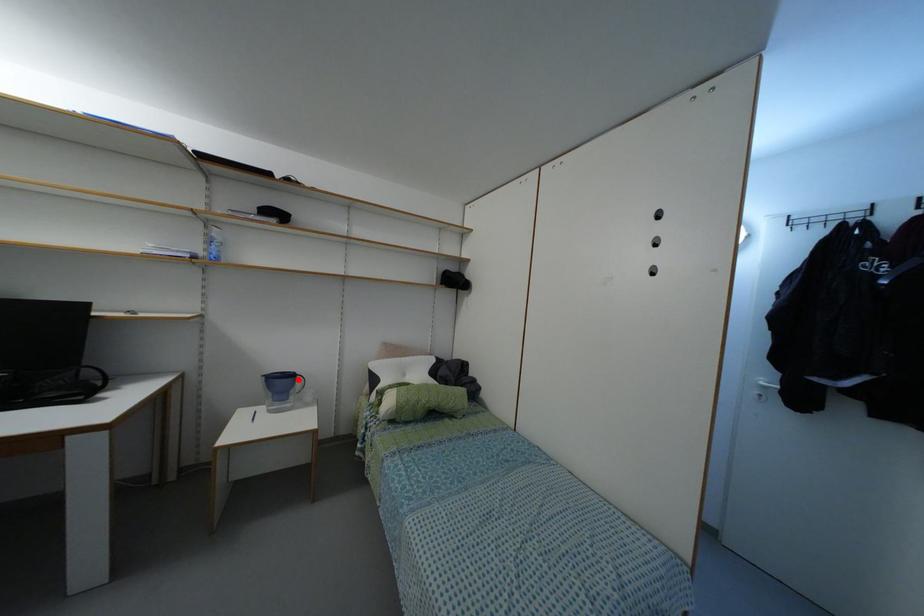
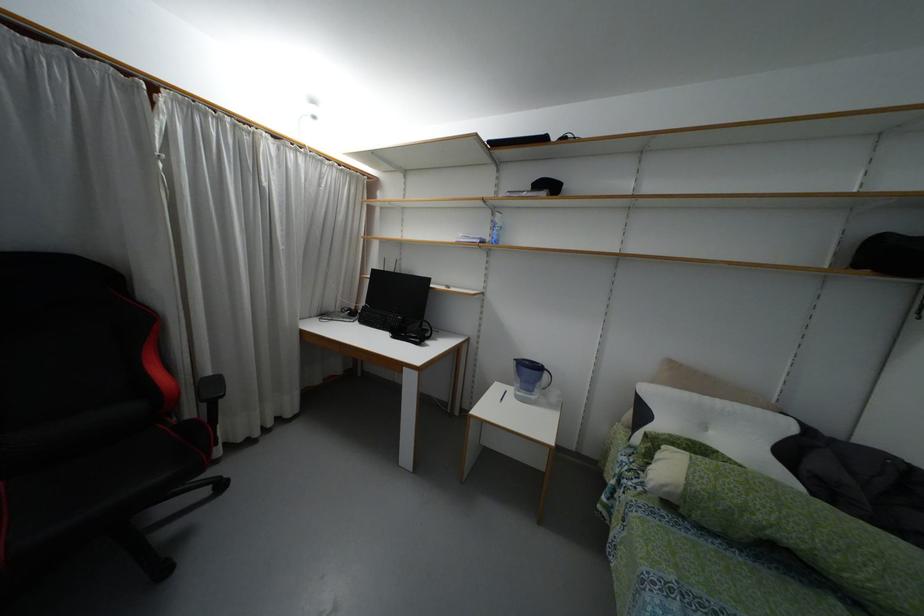
Where in the second image is the point corresponding to the highlighted location from the first image?

(544, 375)